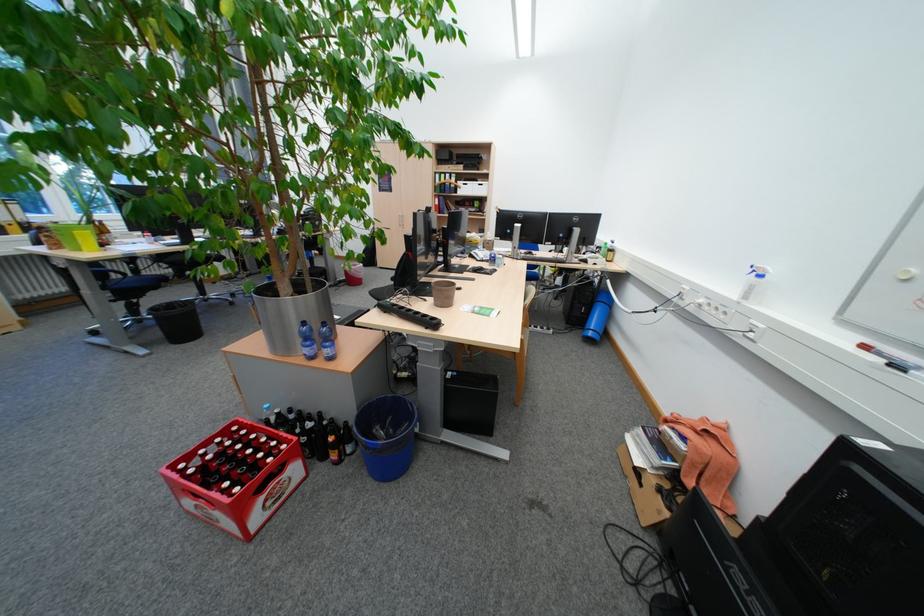
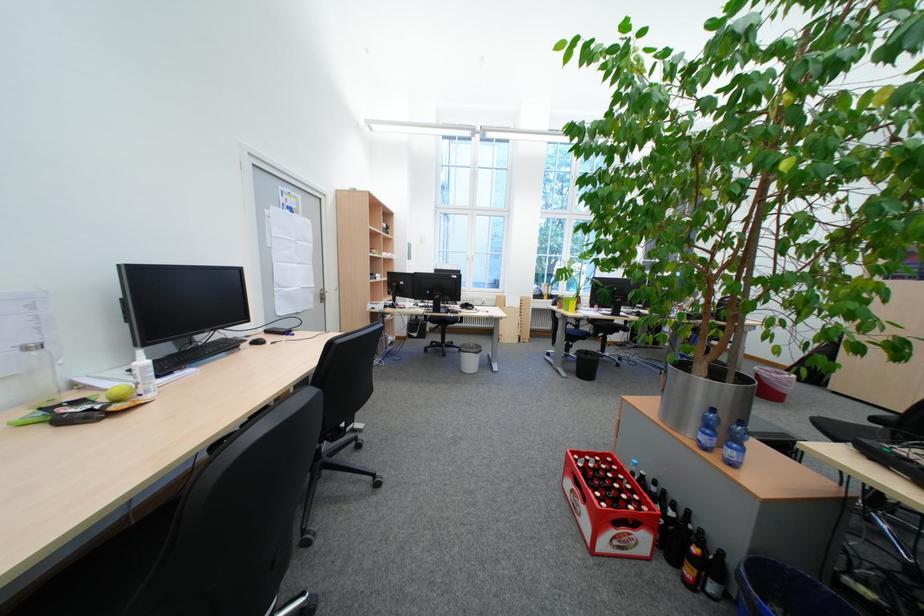
Where in the second image is the point corresponding to [215,456] from the first image?

(599, 462)